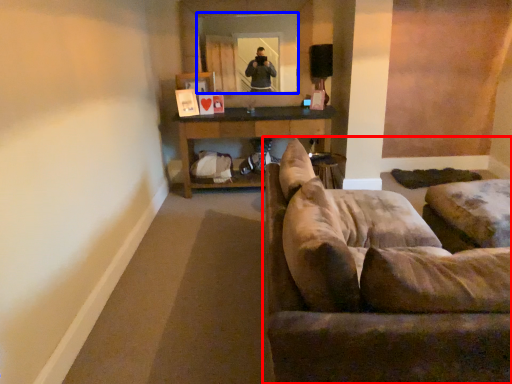
Question: Which object appears farthest to the camera in this image, studio couch (highlighted by a red box) or mirror (highlighted by a blue box)?

Choices:
 (A) studio couch
 (B) mirror

Answer: (B)